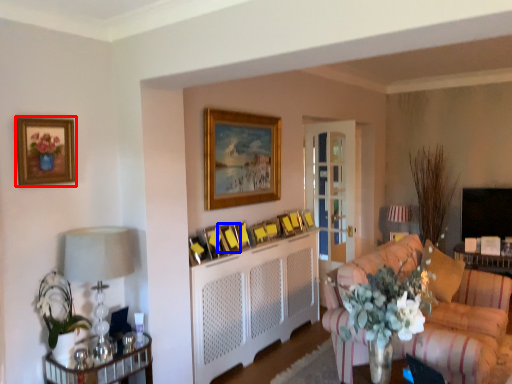
Question: Among these objects, which one is nearest to the camera, picture frame (highlighted by a red box) or picture frame (highlighted by a blue box)?

Choices:
 (A) picture frame
 (B) picture frame

Answer: (A)